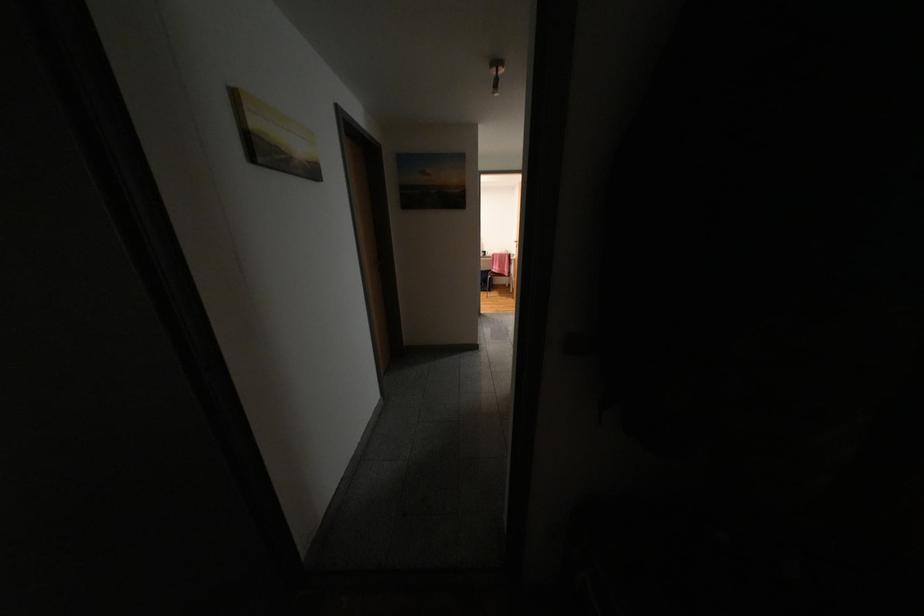
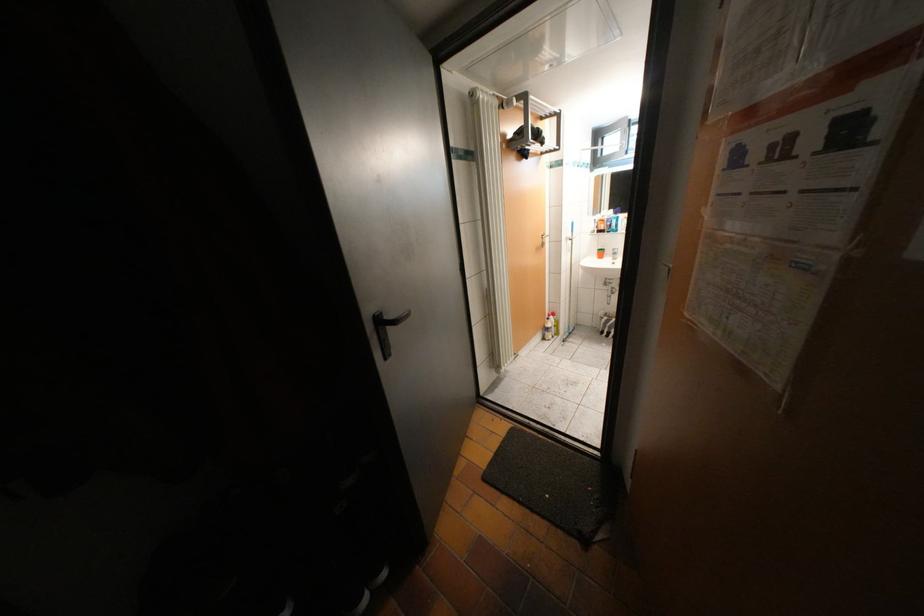
Question: How did the camera likely rotate?

Choices:
 (A) Left
 (B) Right
 (C) Up
 (D) Down

Answer: (B)